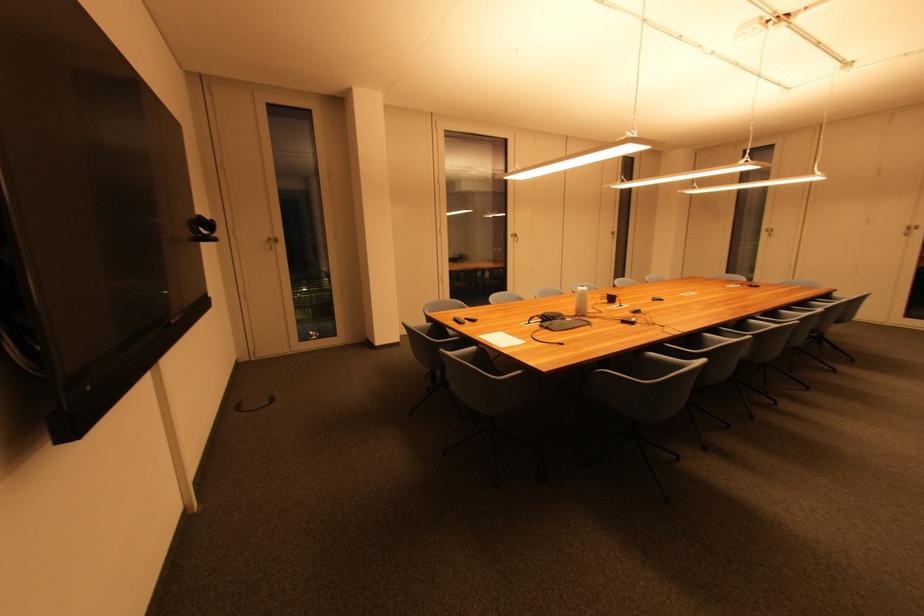
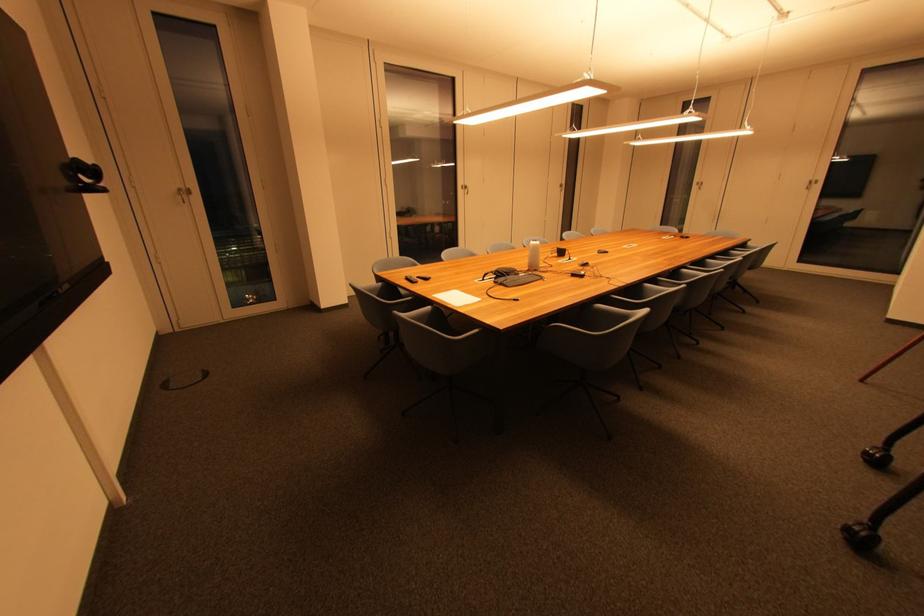
In the second image, find the point that corresponds to (x=586, y=290) in the first image.

(538, 244)